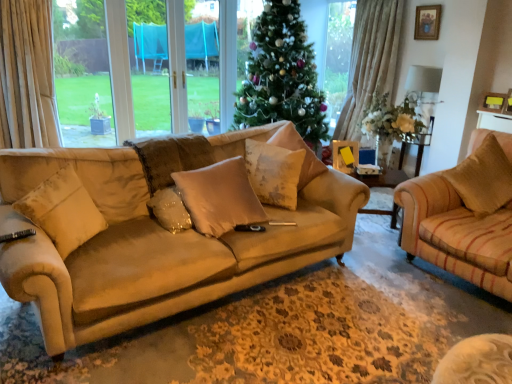
Question: Based on their sizes in the image, would you say green matte christmas tree at center is bigger or smaller than matte yellow picture frame at center, the 2th picture frame positioned from the right?

Choices:
 (A) big
 (B) small

Answer: (A)

Question: From the image's perspective, is green matte christmas tree at center above or below matte yellow picture frame at center, the 2th picture frame viewed from the top?

Choices:
 (A) above
 (B) below

Answer: (A)

Question: Based on their relative distances, which object is nearer to the beige suede pillow at left, the first pillow from the left?

Choices:
 (A) brown textured pillow at right, arranged as the 1th pillow when viewed from the right
 (B) wooden picture frame at upper right, the 1th picture frame in the right-to-left sequence
 (C) fluffy beige pillow at center, which is the third pillow from left to right
 (D) satin beige pillow at center, marked as the 4th pillow in a right-to-left arrangement
 (E) matte yellow picture frame at center, which appears as the 1th picture frame when viewed from the left

Answer: (D)

Question: Based on their relative distances, which object is nearer to the wooden picture frame at upper right, positioned as the 1th picture frame in back-to-front order?

Choices:
 (A) fluffy beige pillow at center, which is the third pillow from left to right
 (B) suede beige couch at center
 (C) beige suede pillow at left, which appears as the 5th pillow when viewed from the right
 (D) matte yellow picture frame at center, which appears as the 1th picture frame when viewed from the left
 (E) green matte christmas tree at center

Answer: (E)